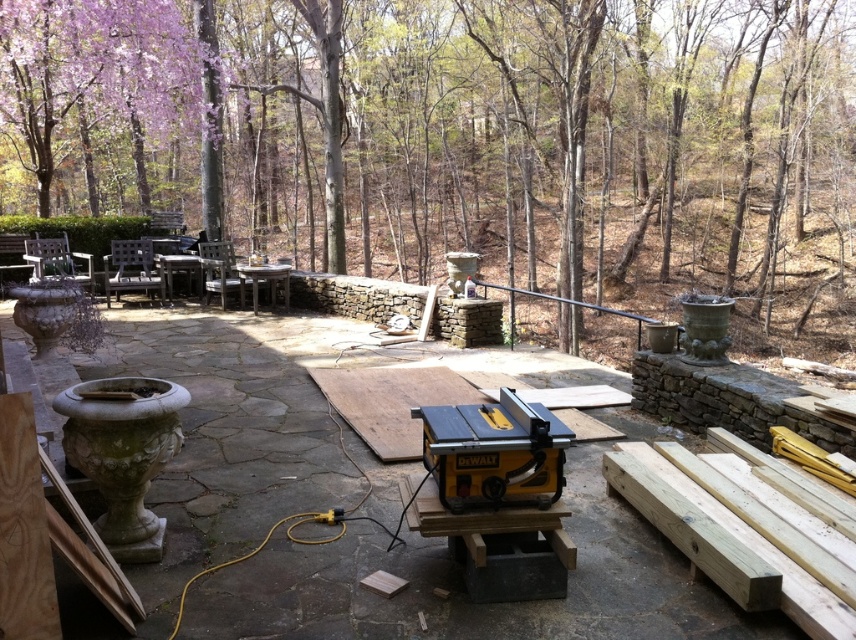
Between brown wood tree at upper center and yellow plastic table saw at center, which one appears on the right side from the viewer's perspective?

From the viewer's perspective, brown wood tree at upper center appears more on the right side.

Is point (220, 138) less distant than point (658, 424)?

No, (220, 138) is further to viewer.

This screenshot has width=856, height=640. What do you see at coordinates (544, 134) in the screenshot?
I see `brown wood tree at upper center` at bounding box center [544, 134].

The width and height of the screenshot is (856, 640). I want to click on brown wood tree at upper center, so click(544, 134).